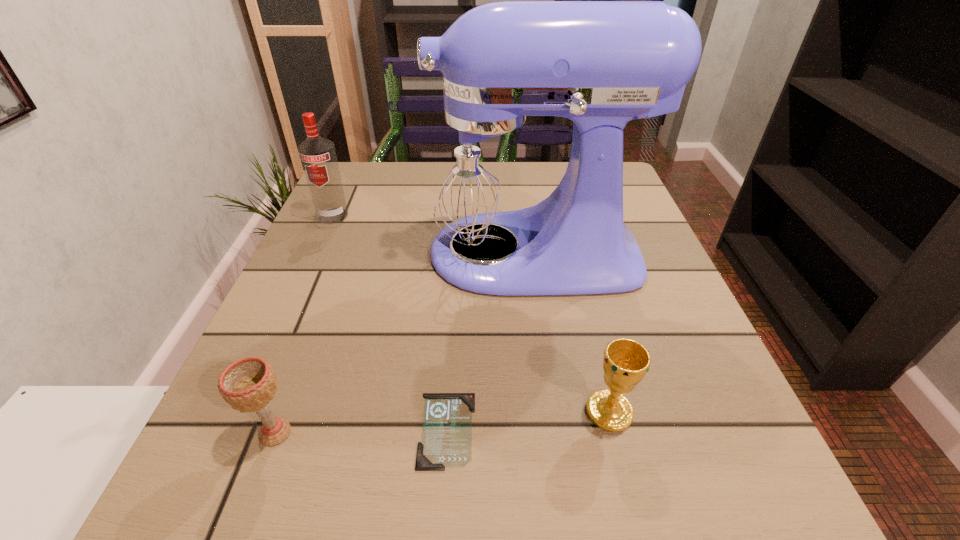
You are a GUI agent. You are given a task and a screenshot of the screen. Output one action in this format:
    pyautogui.click(x=<x>, y=<y>)
    Task: Click on the vacant region between the tallest object and the right chalice
    
    Given the screenshot: What is the action you would take?
    pyautogui.click(x=568, y=332)

The height and width of the screenshot is (540, 960). What are the coordinates of `empty space that is in between the vodka and the right chalice` in the screenshot? It's located at (471, 313).

Locate an element on the screen. The image size is (960, 540). blank region between the vodka and the left chalice is located at coordinates (304, 324).

Choose which object is the nearest neighbor to the mixer. Please provide its 2D coordinates. Your answer should be formatted as a tuple, i.e. [(x, y)], where the tuple contains the x and y coordinates of a point satisfying the conditions above.

[(318, 157)]

At what (x,y) coordinates should I click in order to perform the action: click on object that can be found as the third closest to the left chalice. Please return your answer as a coordinate pair (x, y). Image resolution: width=960 pixels, height=540 pixels. Looking at the image, I should click on (626, 362).

You are a GUI agent. You are given a task and a screenshot of the screen. Output one action in this format:
    pyautogui.click(x=<x>, y=<y>)
    Task: Click on the free location that satisfies the following two spatial constraints: 1. at the mixing area of the tallest object; 2. on the left side of the right chalice
    The image size is (960, 540).
    Given the screenshot: What is the action you would take?
    pyautogui.click(x=547, y=411)

The width and height of the screenshot is (960, 540). I want to click on free space that satisfies the following two spatial constraints: 1. on the front label of the left chalice; 2. on the right side of the fourth shortest object, so click(x=234, y=433).

Where is `vacant area that satisfies the following two spatial constraints: 1. on the back side of the identity card; 2. on the right side of the left chalice`? vacant area that satisfies the following two spatial constraints: 1. on the back side of the identity card; 2. on the right side of the left chalice is located at coordinates (276, 430).

Locate an element on the screen. Image resolution: width=960 pixels, height=540 pixels. free space in the image that satisfies the following two spatial constraints: 1. at the mixing area of the tallest object; 2. on the back side of the right chalice is located at coordinates (547, 411).

Locate an element on the screen. Image resolution: width=960 pixels, height=540 pixels. vacant region that satisfies the following two spatial constraints: 1. on the front label of the vodka; 2. on the left side of the right chalice is located at coordinates (244, 411).